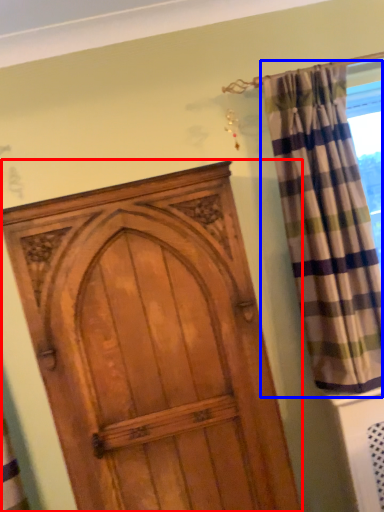
Question: Among these objects, which one is farthest to the camera, door (highlighted by a red box) or curtain (highlighted by a blue box)?

Choices:
 (A) door
 (B) curtain

Answer: (B)